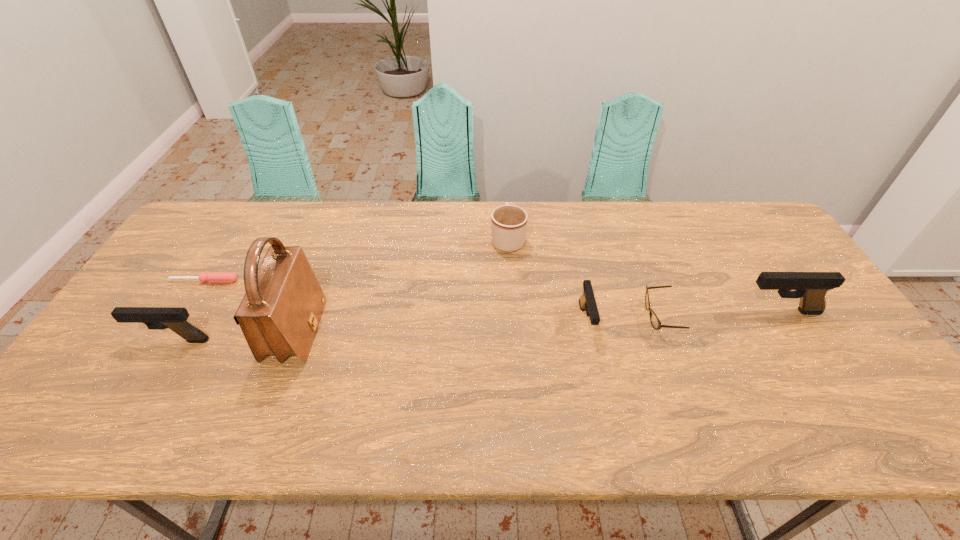
What are the coordinates of `free space in the image that satisfies the following two spatial constraints: 1. on the front-facing side of the spectacles; 2. on the front-facing side of the third object from right to left` in the screenshot? It's located at (662, 321).